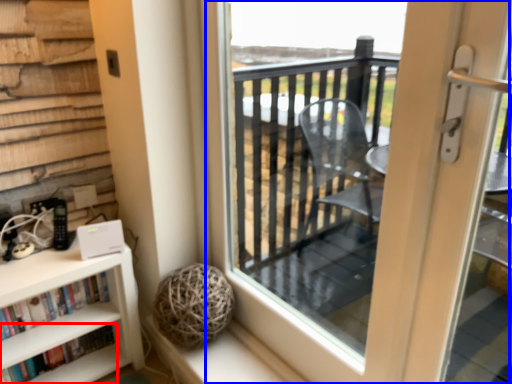
Question: Among these objects, which one is nearest to the camera, book (highlighted by a red box) or screen door (highlighted by a blue box)?

Choices:
 (A) book
 (B) screen door

Answer: (B)